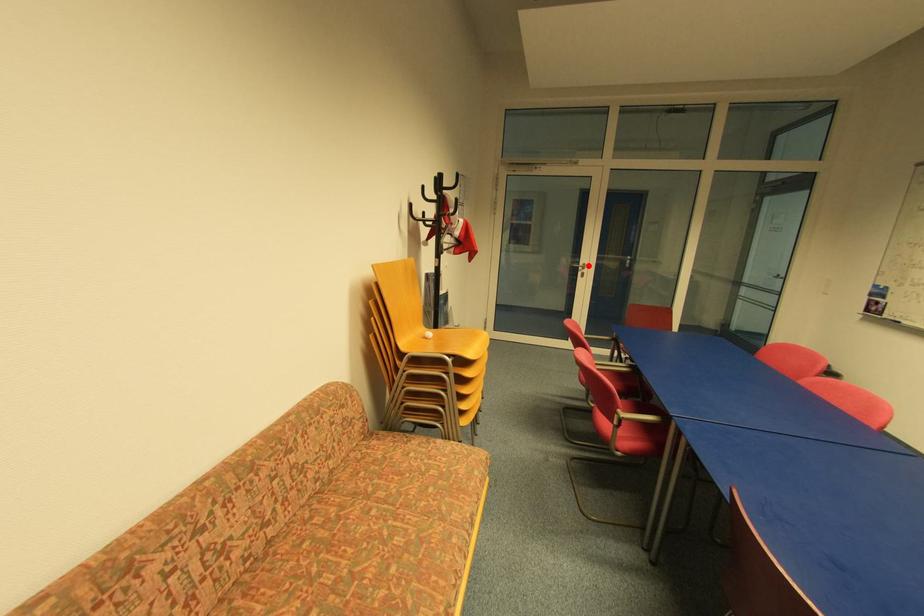
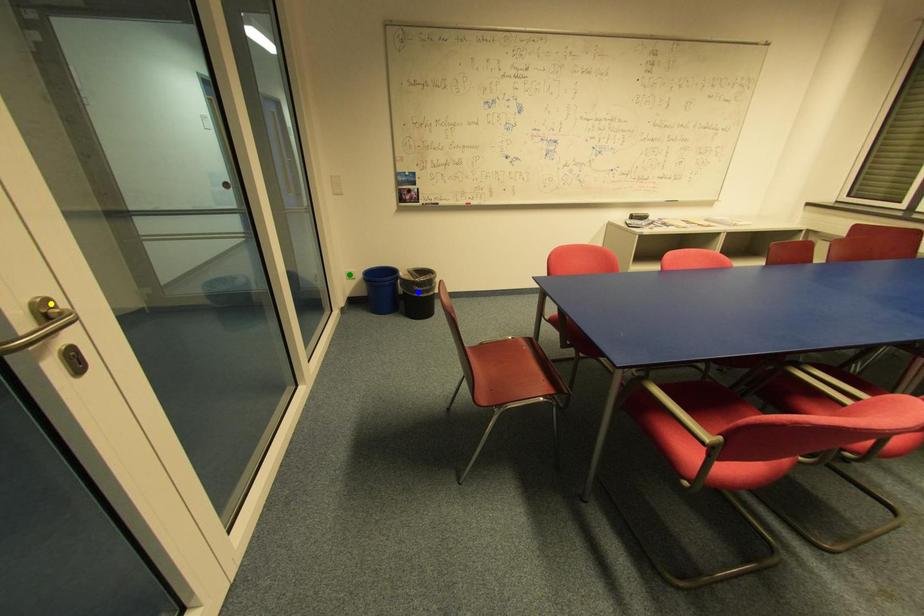
Question: I am providing you with two images of the same scene from different viewpoints. A red point is marked on the first image. You are given multiple points on the second image. Which spot in image 2 lines up with the point in image 1?

Choices:
 (A) green point
 (B) yellow point
 (C) blue point

Answer: (B)